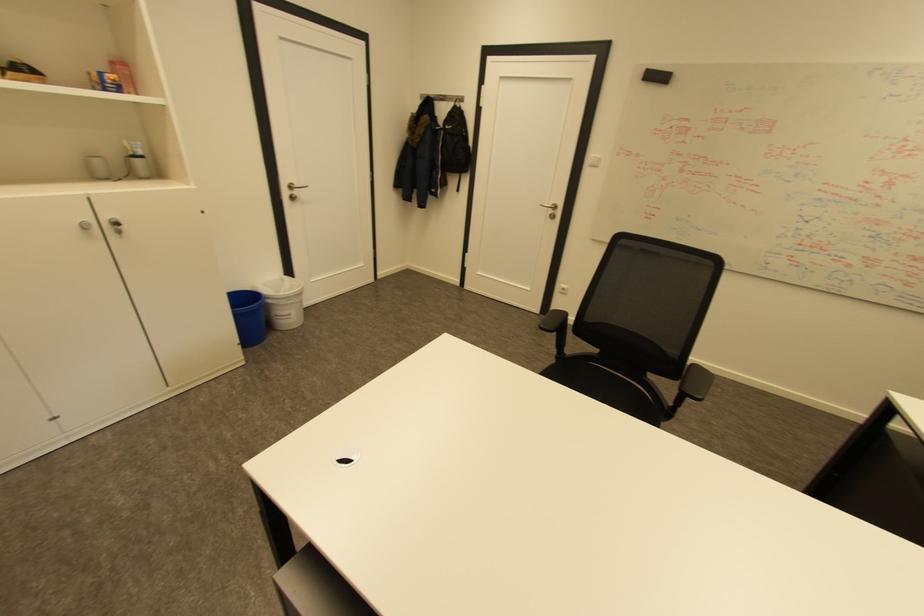
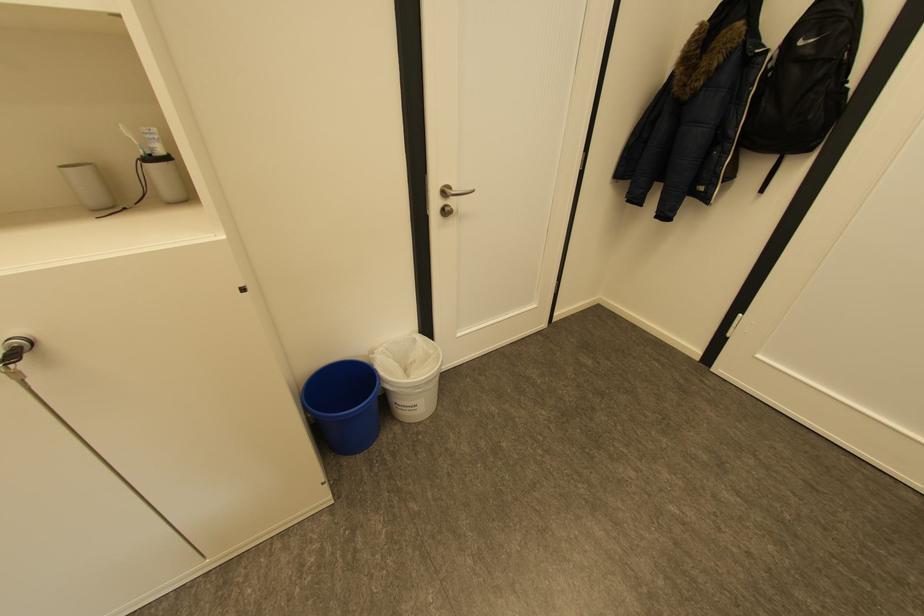
Locate, in the second image, the point that corresponds to (x=298, y=187) in the first image.

(451, 192)